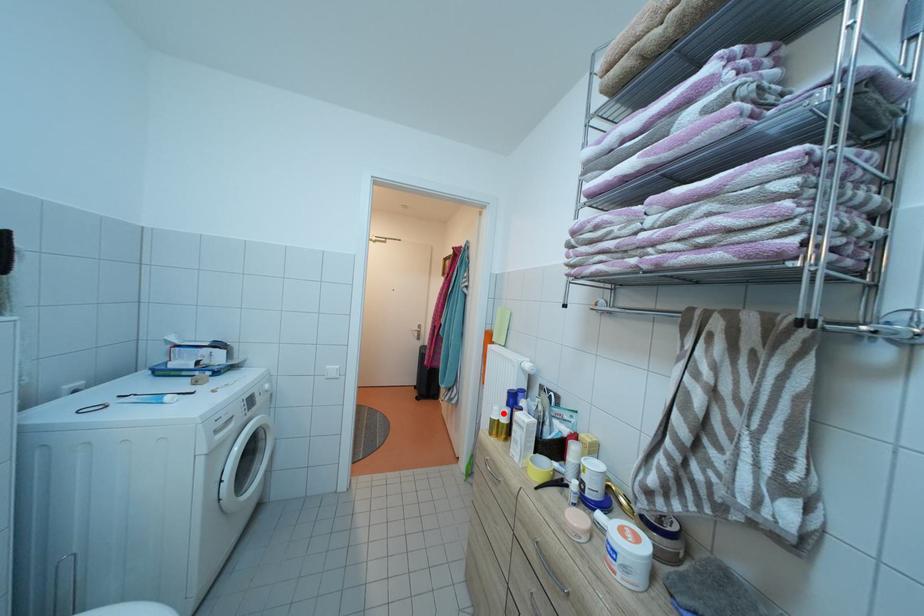
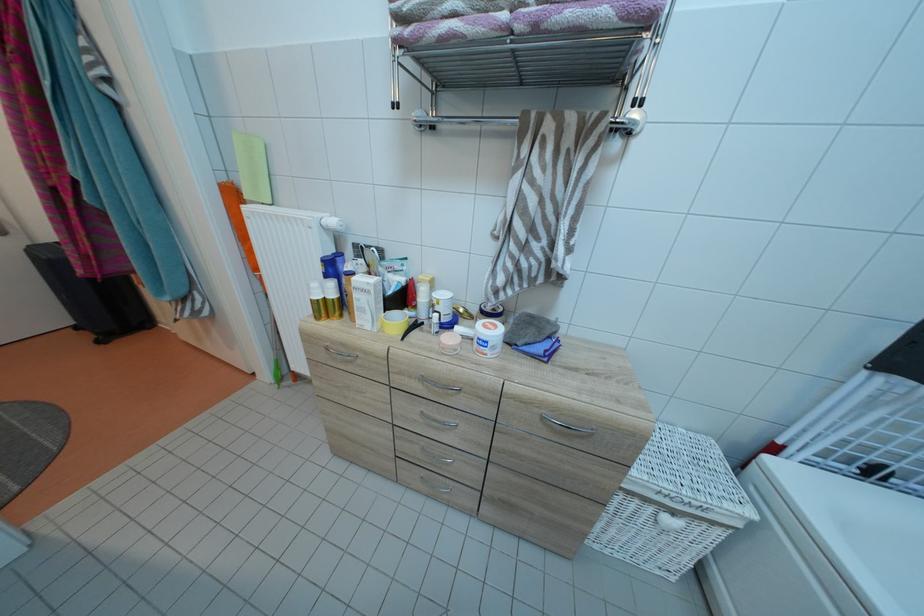
Question: A red point is marked in image1. In image2, is the corresponding 3D point closer to the camera or farther? Reply with the corresponding letter.

Choices:
 (A) The corresponding 3D point is closer.
 (B) The corresponding 3D point is farther.

Answer: (B)